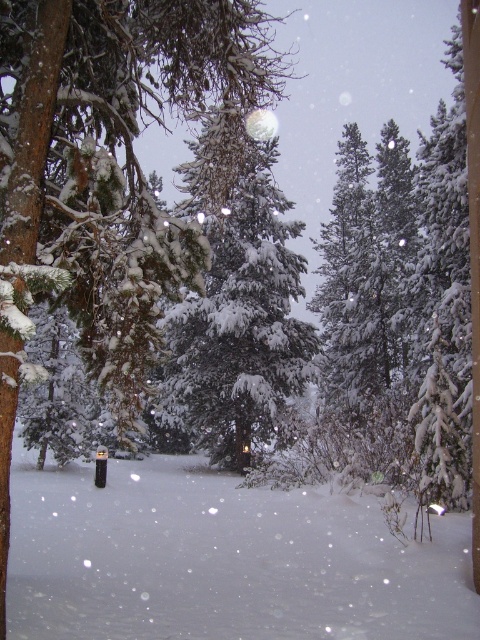
Question: From the image, what is the correct spatial relationship of snow-covered evergreen tree at center in relation to green textured pine tree at center?

Choices:
 (A) left
 (B) right

Answer: (B)

Question: Which point is closer to the camera taking this photo?

Choices:
 (A) (210, 504)
 (B) (206, 10)

Answer: (B)

Question: Does snow-covered evergreen tree at center appear over green textured pine tree at center?

Choices:
 (A) yes
 (B) no

Answer: (A)

Question: Which of the following is the closest to the observer?

Choices:
 (A) snow-covered evergreen tree at center
 (B) green textured pine tree at center
 (C) white fluffy snow at center

Answer: (A)

Question: Which is farther from the green textured pine tree at center?

Choices:
 (A) white fluffy snow at center
 (B) snow-covered evergreen tree at center

Answer: (B)

Question: Is the position of white fluffy snow at center less distant than that of snow-covered evergreen tree at center?

Choices:
 (A) no
 (B) yes

Answer: (A)